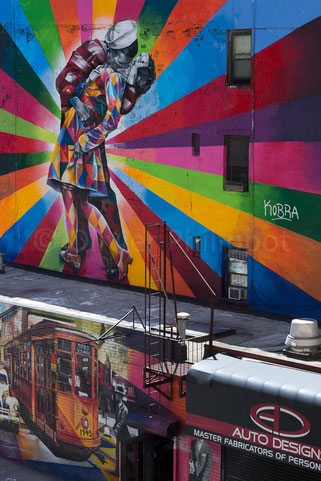
Locate an element on the screen. ladder is located at coordinates (154, 345).